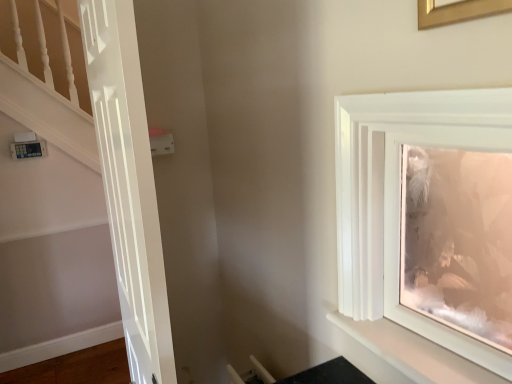
This screenshot has width=512, height=384. I want to click on blank space situated above white glossy shelf at upper right (from a real-world perspective), so click(416, 351).